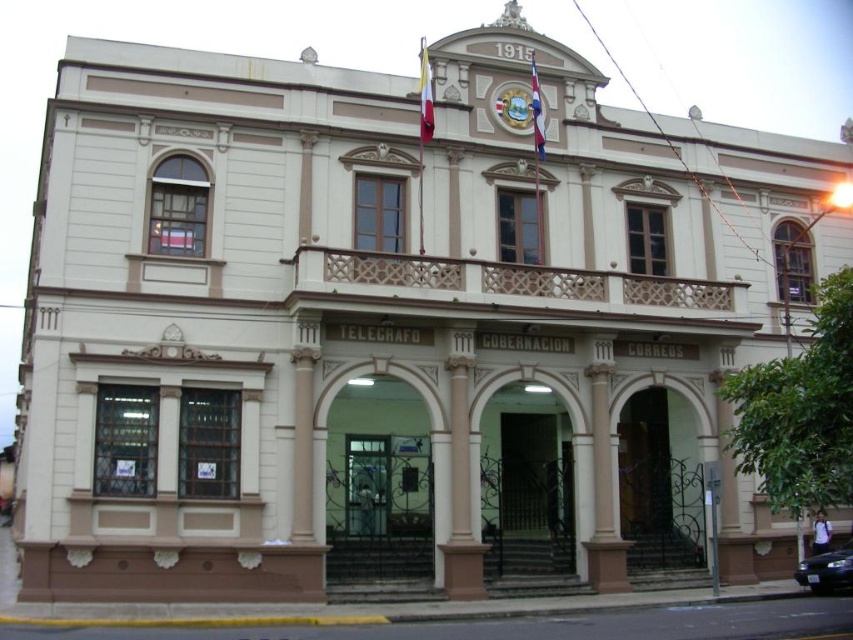
You are a photographer planning to take a wide shot of the building. The white marble column at center and the shiny black sedan at lower right are both in your frame. Which object will appear wider in the photo?

The white marble column at center will appear wider in the photo because its width is larger than the shiny black sedan at lower right.

You are a photographer planning to take a picture of the building. You want to ensure that both the white marble column at center and the shiny black sedan at lower right are clearly visible in the frame. Given their sizes, which object should you focus on to ensure both are in focus?

The white marble column at center is larger than the shiny black sedan at lower right, so focusing on the column will help ensure both are in focus as it occupies more of the frame.